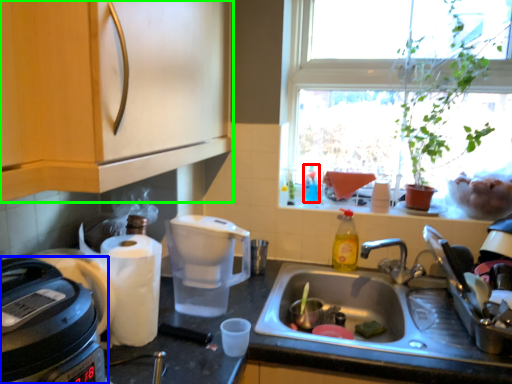
Question: Which object is the closest to the bottle (highlighted by a red box)? Choose among these: home appliance (highlighted by a blue box) or cabinetry (highlighted by a green box).

Choices:
 (A) home appliance
 (B) cabinetry

Answer: (B)